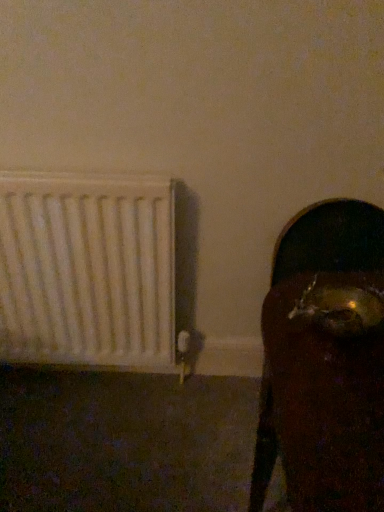
Question: Considering their positions, is white matte radiator at left located in front of or behind gold metallic skull at right?

Choices:
 (A) behind
 (B) front

Answer: (A)

Question: In the image, is white matte radiator at left on the left side or the right side of gold metallic skull at right?

Choices:
 (A) right
 (B) left

Answer: (B)

Question: Considering the positions of white matte radiator at left and gold metallic skull at right in the image, is white matte radiator at left wider or thinner than gold metallic skull at right?

Choices:
 (A) thin
 (B) wide

Answer: (A)

Question: Is gold metallic skull at right inside the boundaries of white matte radiator at left, or outside?

Choices:
 (A) inside
 (B) outside

Answer: (B)

Question: Would you say gold metallic skull at right is to the left or to the right of white matte radiator at left in the picture?

Choices:
 (A) right
 (B) left

Answer: (A)

Question: Considering the positions of gold metallic skull at right and white matte radiator at left in the image, is gold metallic skull at right wider or thinner than white matte radiator at left?

Choices:
 (A) thin
 (B) wide

Answer: (B)

Question: Considering the positions of gold metallic skull at right and white matte radiator at left in the image, is gold metallic skull at right bigger or smaller than white matte radiator at left?

Choices:
 (A) big
 (B) small

Answer: (A)